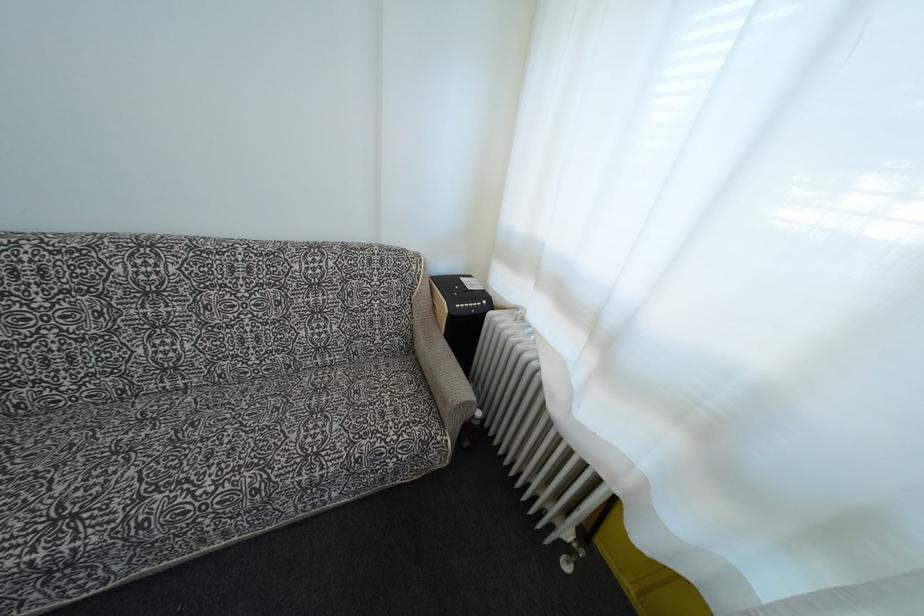
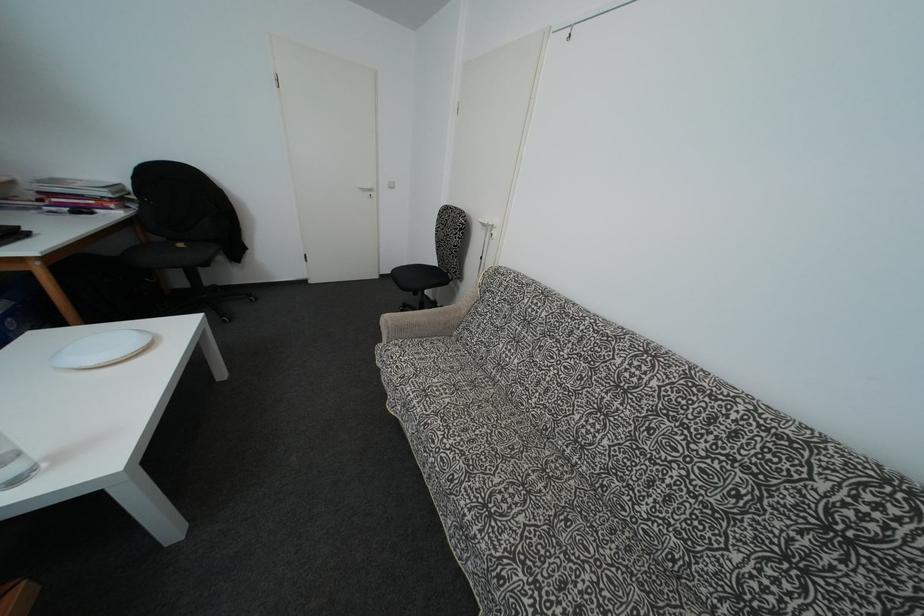
Question: The first image is from the beginning of the video and the second image is from the end. How did the camera likely rotate when shooting the video?

Choices:
 (A) Left
 (B) Right
 (C) Up
 (D) Down

Answer: (A)